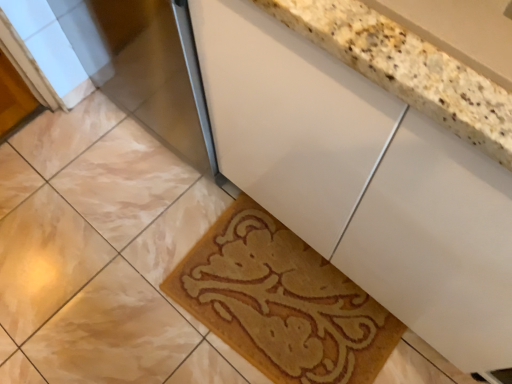
I want to click on free spot above marble tile at lower left (from a real-world perspective), so click(59, 241).